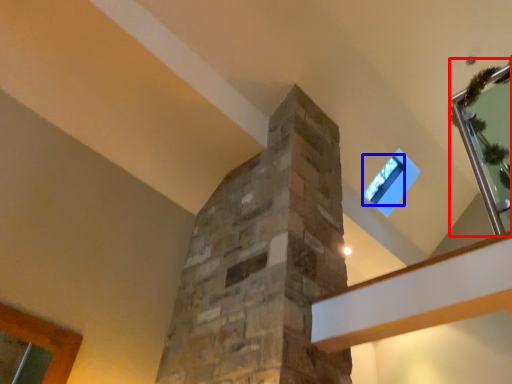
Question: Which of the following is the farthest to the observer, glass door (highlighted by a red box) or window (highlighted by a blue box)?

Choices:
 (A) glass door
 (B) window

Answer: (B)